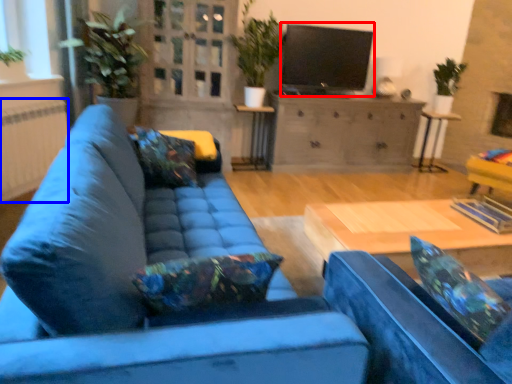
Question: Which point is closer to the camera, open (highlighted by a red box) or radiator (highlighted by a blue box)?

Choices:
 (A) open
 (B) radiator

Answer: (B)